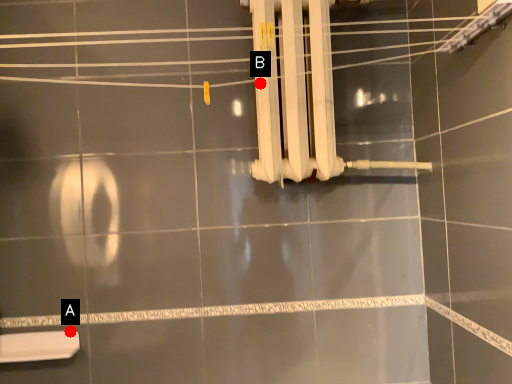
Question: Two points are circled on the image, labeled by A and B beside each circle. Which point is closer to the camera taking this photo?

Choices:
 (A) A is closer
 (B) B is closer

Answer: (B)